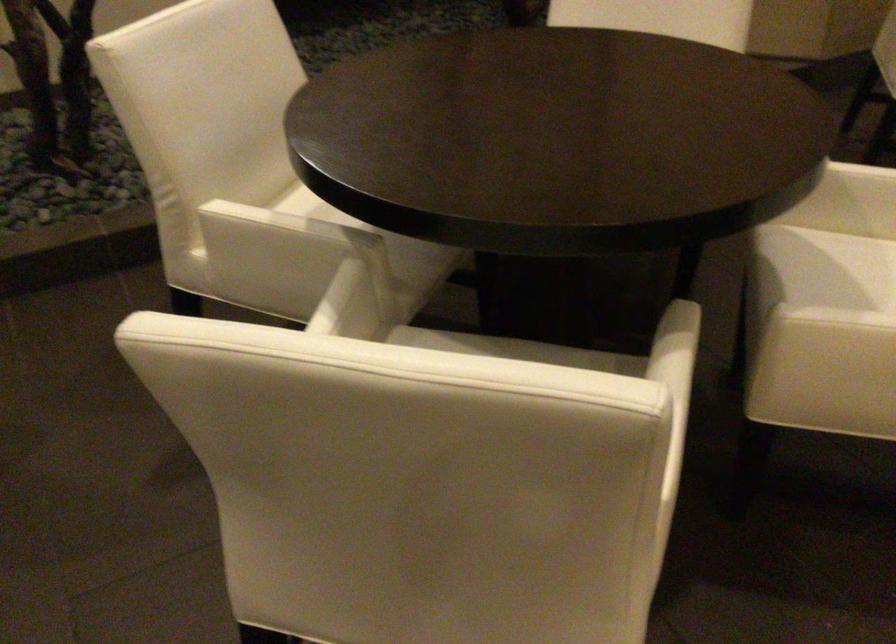
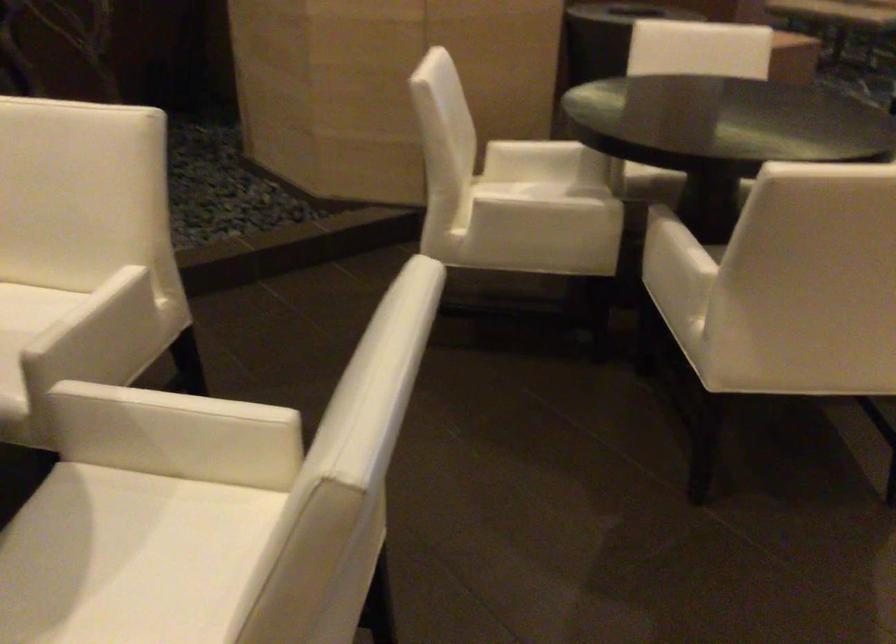
Question: Which direction would the cameraman need to move to produce the second image? Reply with the corresponding letter.

Choices:
 (A) Left
 (B) Right
 (C) Forward
 (D) Backward

Answer: (B)